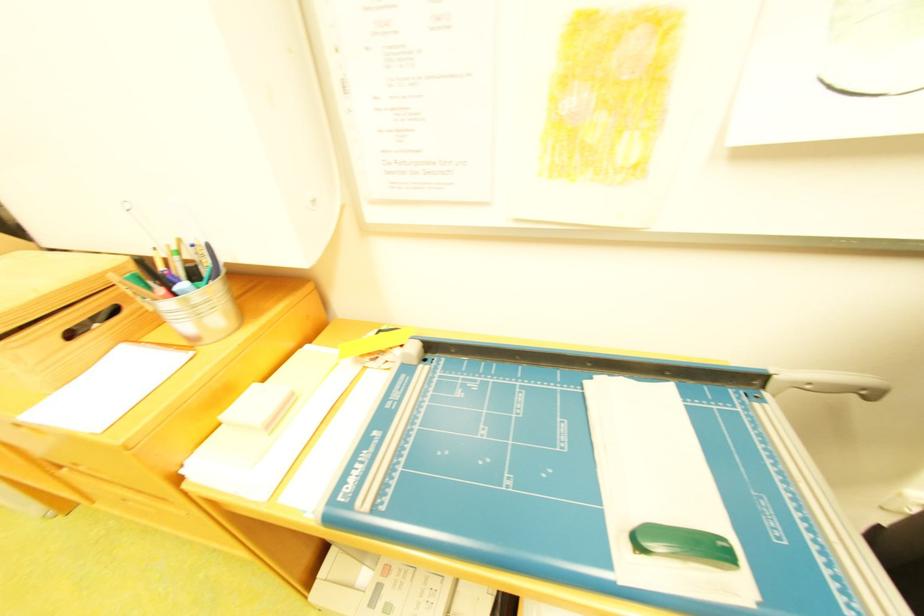
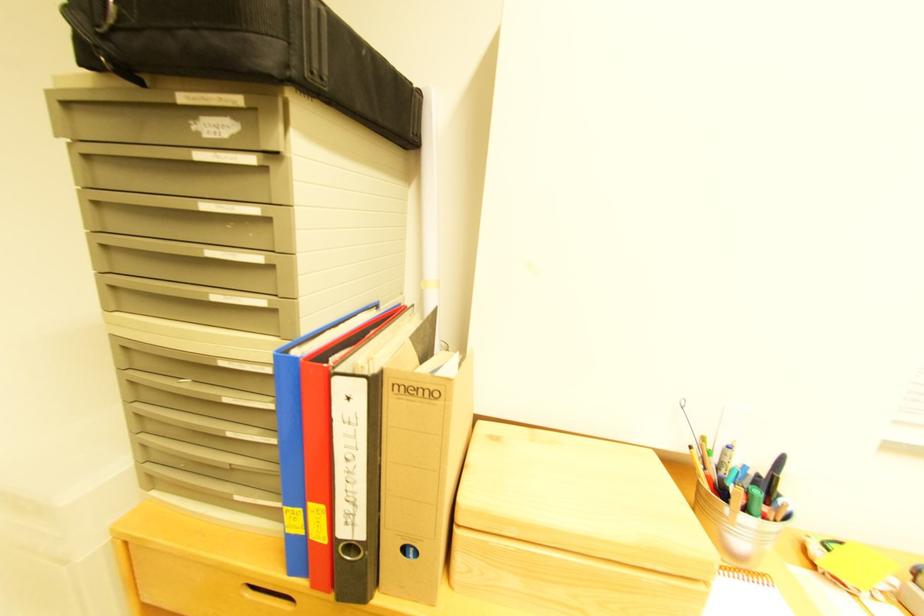
Question: The first image is from the beginning of the video and the second image is from the end. How did the camera likely rotate when shooting the video?

Choices:
 (A) Left
 (B) Right
 (C) Up
 (D) Down

Answer: (C)